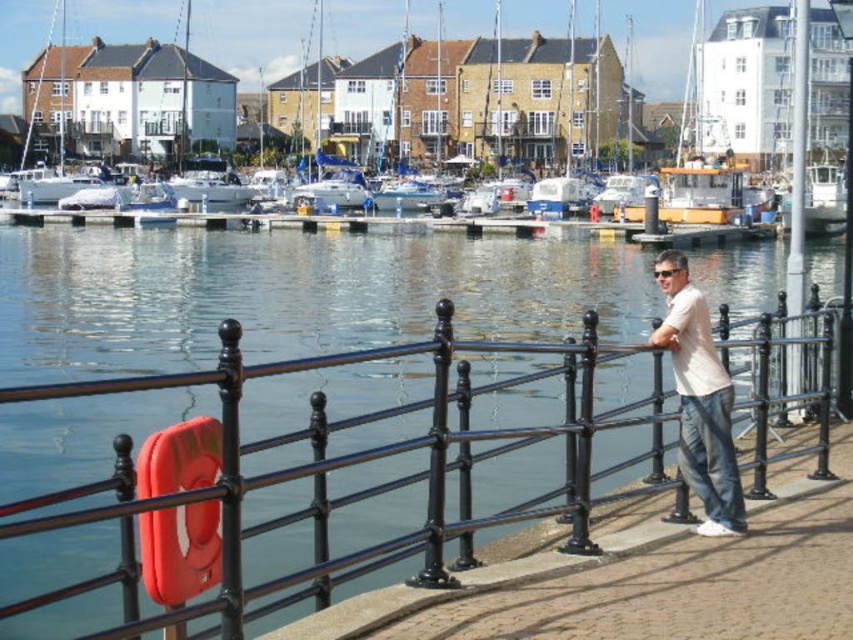
Can you confirm if black metal fence at center is positioned to the left of white cotton shirt at center?

Indeed, black metal fence at center is positioned on the left side of white cotton shirt at center.

Between black metal fence at center and white cotton shirt at center, which one has more height?

black metal fence at center

Where is `black metal fence at center`? The image size is (853, 640). black metal fence at center is located at coordinates (328, 477).

Is point (241, 4) positioned behind point (682, 401)?

Yes.

Is white plastic boat at center bigger than white cotton shirt at center?

Indeed, white plastic boat at center has a larger size compared to white cotton shirt at center.

Who is more distant from viewer, (454, 13) or (711, 525)?

The point (454, 13) is more distant.

Identify the location of white plastic boat at center. Image resolution: width=853 pixels, height=640 pixels. (251, 35).

Where is `black metal fence at center`? The image size is (853, 640). black metal fence at center is located at coordinates (328, 477).

Who is shorter, black metal fence at center or white plastic boat at center?

black metal fence at center

Is point (302, 369) closer to viewer compared to point (415, 4)?

Yes.

The image size is (853, 640). I want to click on black metal fence at center, so click(328, 477).